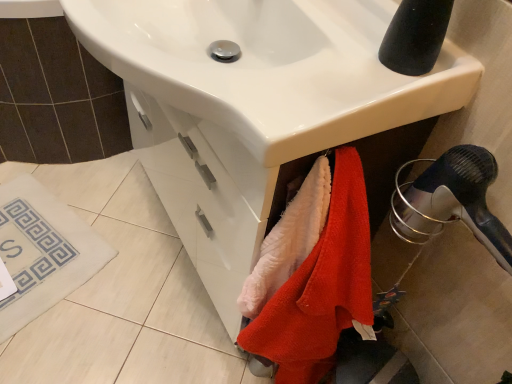
Question: Would you say white glossy sink at center is part of fluffy pink towel at lower center, acting as the second beach towel starting from the bottom,'s contents?

Choices:
 (A) yes
 (B) no

Answer: (B)

Question: Is fluffy pink towel at lower center, which is the first beach towel in top-to-bottom order, facing towards white glossy sink at center?

Choices:
 (A) yes
 (B) no

Answer: (B)

Question: Is fluffy pink towel at lower center, acting as the second beach towel starting from the bottom, to the left of white glossy sink at center from the viewer's perspective?

Choices:
 (A) no
 (B) yes

Answer: (A)

Question: Would you consider fluffy pink towel at lower center, which is the first beach towel in top-to-bottom order, to be distant from white glossy sink at center?

Choices:
 (A) yes
 (B) no

Answer: (B)

Question: Is fluffy pink towel at lower center, acting as the second beach towel starting from the bottom, smaller than white glossy sink at center?

Choices:
 (A) no
 (B) yes

Answer: (B)

Question: Is fluffy pink towel at lower center, acting as the second beach towel starting from the bottom, touching white glossy sink at center?

Choices:
 (A) no
 (B) yes

Answer: (A)

Question: From a real-world perspective, is fluffy pink towel at lower center, acting as the second beach towel starting from the bottom, under black plastic hair dryer at lower right?

Choices:
 (A) no
 (B) yes

Answer: (B)

Question: Is fluffy pink towel at lower center, acting as the second beach towel starting from the bottom, to the left of black plastic hair dryer at lower right from the viewer's perspective?

Choices:
 (A) yes
 (B) no

Answer: (A)

Question: Is fluffy pink towel at lower center, acting as the second beach towel starting from the bottom, oriented towards black plastic hair dryer at lower right?

Choices:
 (A) no
 (B) yes

Answer: (A)

Question: Is fluffy pink towel at lower center, acting as the second beach towel starting from the bottom, oriented away from black plastic hair dryer at lower right?

Choices:
 (A) yes
 (B) no

Answer: (B)

Question: Does fluffy pink towel at lower center, which is the first beach towel in top-to-bottom order, have a smaller size compared to black plastic hair dryer at lower right?

Choices:
 (A) yes
 (B) no

Answer: (A)

Question: Is fluffy pink towel at lower center, acting as the second beach towel starting from the bottom, positioned behind black plastic hair dryer at lower right?

Choices:
 (A) yes
 (B) no

Answer: (A)

Question: Considering the relative positions of fluffy pink towel at lower center, which is the first beach towel in top-to-bottom order, and white fabric bath mat at lower left in the image provided, is fluffy pink towel at lower center, which is the first beach towel in top-to-bottom order, to the left of white fabric bath mat at lower left from the viewer's perspective?

Choices:
 (A) no
 (B) yes

Answer: (A)